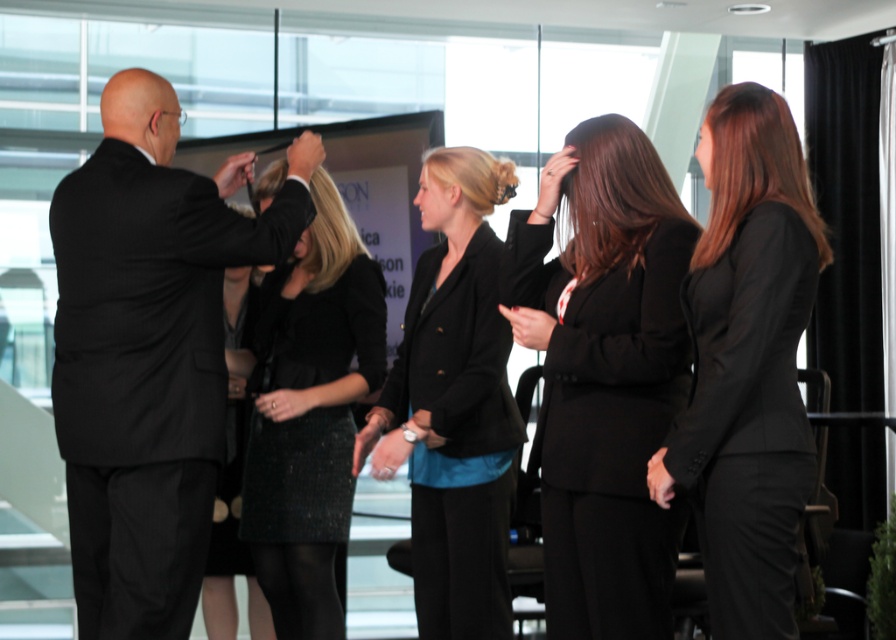
You are standing at the entrance of the room and want to approach the black textured suit at left. Which direction should you move to reach it?

To reach the black textured suit at left, move towards the left side of the room since the black textured suit at left is located at point (145, 356).

You are attending a formal event and need to determine the spatial arrangement of the attendees. Which object, the black smooth suit at right or the black sequined skirt at center, is positioned higher in the image?

The black smooth suit at right is positioned higher than the black sequined skirt at center in the image.